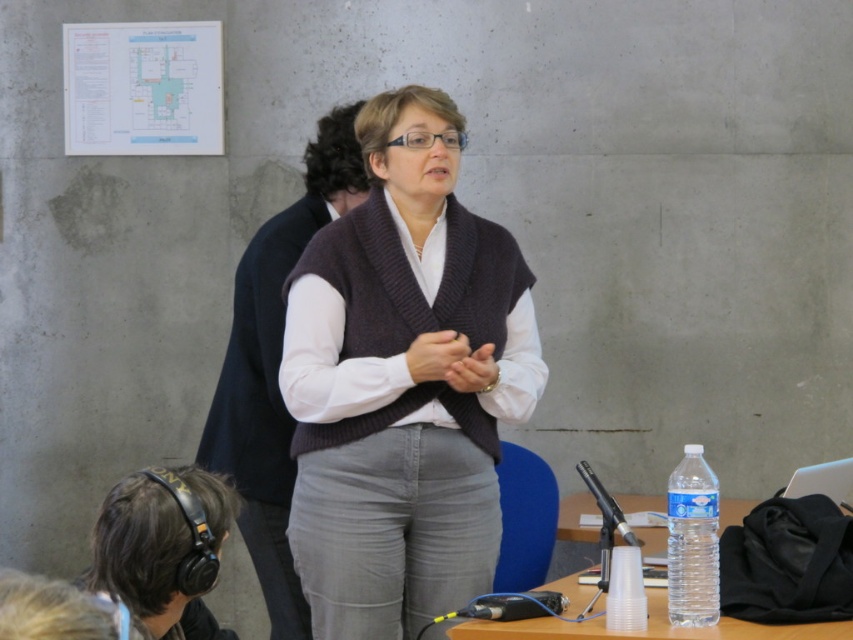
Does knitted dark brown vest at center have a larger size compared to clear plastic bottle at right?

Indeed, knitted dark brown vest at center has a larger size compared to clear plastic bottle at right.

Which is in front, point (286, 314) or point (704, 556)?

Point (704, 556) is in front.

Which is in front, point (421, 156) or point (688, 566)?

Point (688, 566)

Image resolution: width=853 pixels, height=640 pixels. Find the location of `knitted dark brown vest at center`. knitted dark brown vest at center is located at coordinates (403, 381).

Can you confirm if clear plastic cup at lower center is taller than clear plastic bottle at right?

In fact, clear plastic cup at lower center may be shorter than clear plastic bottle at right.

Is clear plastic cup at lower center to the left of clear plastic bottle at right from the viewer's perspective?

Incorrect, clear plastic cup at lower center is not on the left side of clear plastic bottle at right.

Which is behind, point (730, 502) or point (682, 561)?

The point (730, 502) is behind.

This screenshot has height=640, width=853. I want to click on clear plastic cup at lower center, so click(x=647, y=627).

Which is below, knitted dark brown vest at center or clear plastic cup at lower center?

clear plastic cup at lower center

Who is positioned more to the right, knitted dark brown vest at center or clear plastic cup at lower center?

clear plastic cup at lower center is more to the right.

Between point (456, 388) and point (567, 595), which one is positioned behind?

Point (567, 595)

This screenshot has height=640, width=853. What are the coordinates of `knitted dark brown vest at center` in the screenshot? It's located at (403, 381).